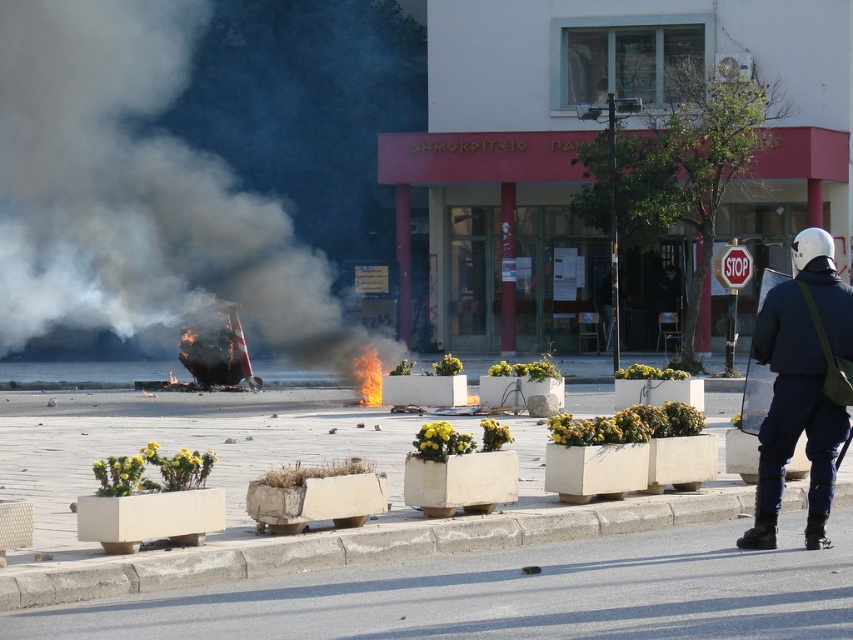
You are a drone operator trying to land a drone on a flat surface. You have a map showing coordinates. The drone needs to land on the concrete at lower center. What are the coordinates to land the drone?

The coordinates to land the drone on the concrete at lower center are point (354, 547).